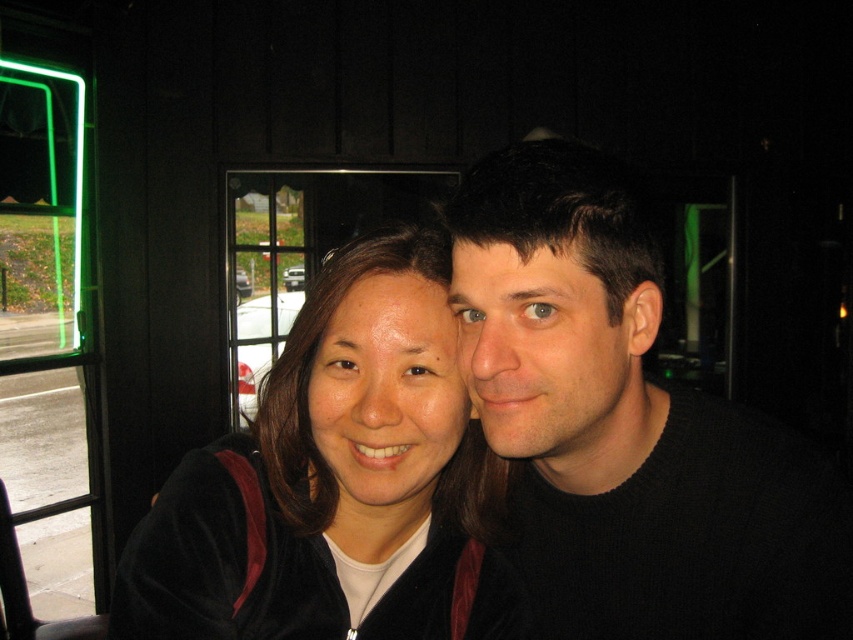
Question: Which of the following is the farthest from the observer?

Choices:
 (A) green neon sign at left
 (B) velvet black jacket at center

Answer: (A)

Question: Which of the following is the farthest from the observer?

Choices:
 (A) green neon sign at left
 (B) black velvety jacket at center

Answer: (A)

Question: Does black velvety jacket at center have a lesser width compared to velvet black jacket at center?

Choices:
 (A) no
 (B) yes

Answer: (A)

Question: Can you confirm if black velvety jacket at center is thinner than velvet black jacket at center?

Choices:
 (A) yes
 (B) no

Answer: (B)

Question: Is black velvety jacket at center to the left of green neon sign at left from the viewer's perspective?

Choices:
 (A) no
 (B) yes

Answer: (A)

Question: Which of the following is the closest to the observer?

Choices:
 (A) velvet black jacket at center
 (B) black velvety jacket at center
 (C) green neon sign at left

Answer: (B)